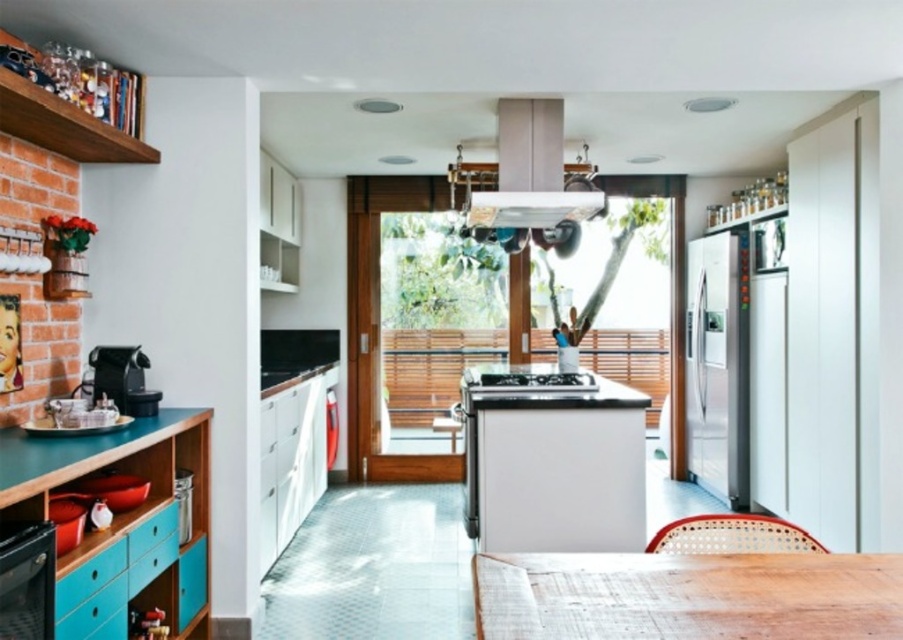
Question: Estimate the real-world distances between objects in this image. Which object is closer to the satin silver refrigerator at right?

Choices:
 (A) black glass oven at lower left
 (B) brushed metal toaster at lower left

Answer: (B)

Question: Among these objects, which one is nearest to the camera?

Choices:
 (A) wooden table at center
 (B) matte gray exhaust hood at upper center
 (C) satin silver refrigerator at right

Answer: (A)

Question: Which object is the farthest from the wooden table at center?

Choices:
 (A) white glossy stove at center
 (B) brushed metal toaster at lower left
 (C) matte gray exhaust hood at upper center

Answer: (C)

Question: Does satin silver refrigerator at right have a lesser width compared to brushed metal toaster at lower left?

Choices:
 (A) no
 (B) yes

Answer: (A)

Question: Can you confirm if black glass oven at lower left is positioned above brown woven chair at lower right?

Choices:
 (A) no
 (B) yes

Answer: (A)

Question: Does wooden table at center have a smaller size compared to satin silver refrigerator at right?

Choices:
 (A) no
 (B) yes

Answer: (B)